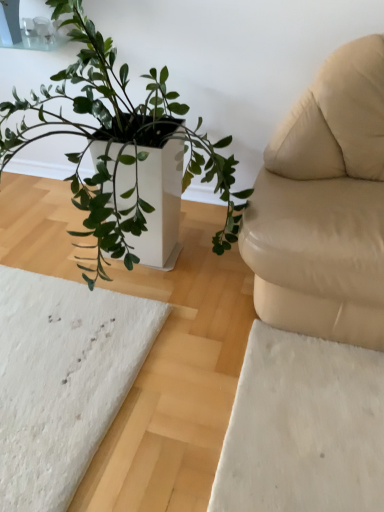
I want to click on free space in front of white matte planter at center, so click(159, 403).